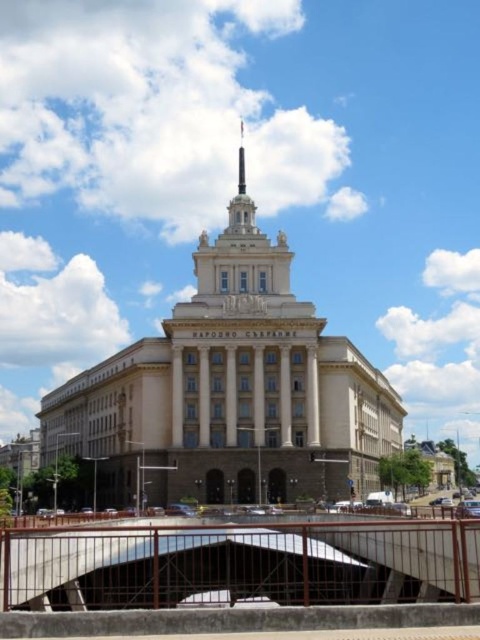
Question: Observing the image, what is the correct spatial positioning of beige stone building at center in reference to brown metal bridge at lower center?

Choices:
 (A) below
 (B) above

Answer: (B)

Question: Which object is farther from the camera taking this photo?

Choices:
 (A) beige stone building at center
 (B) brown metal bridge at lower center
 (C) polished gold spire at center top

Answer: (C)

Question: Which of the following is the closest to the observer?

Choices:
 (A) brown metal bridge at lower center
 (B) polished gold spire at center top
 (C) beige stone building at center

Answer: (A)

Question: Which point is closer to the camera?

Choices:
 (A) brown metal bridge at lower center
 (B) beige stone building at center
 (C) polished gold spire at center top

Answer: (A)

Question: Does beige stone building at center have a smaller size compared to polished gold spire at center top?

Choices:
 (A) no
 (B) yes

Answer: (A)

Question: Is beige stone building at center to the right of polished gold spire at center top from the viewer's perspective?

Choices:
 (A) yes
 (B) no

Answer: (A)